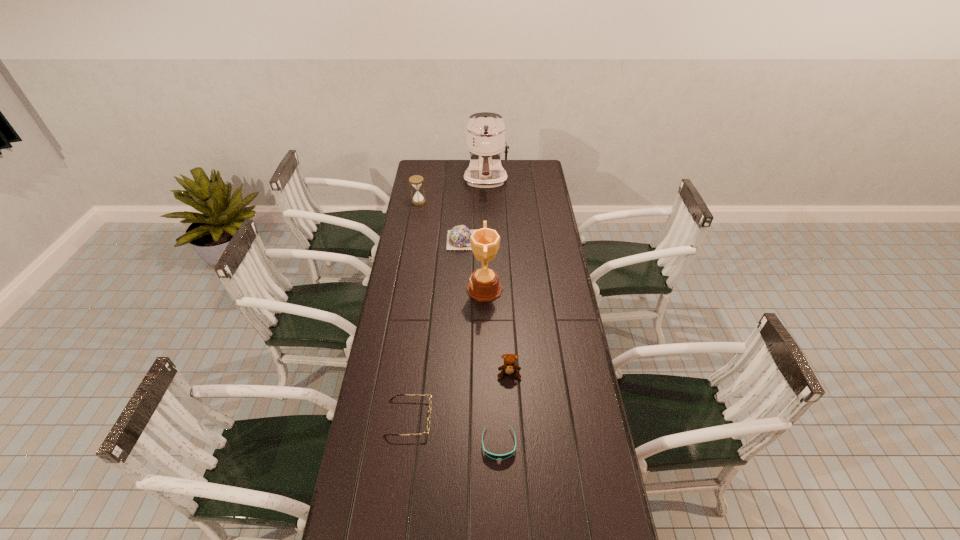
Locate an element on the screen. free space located on the front-facing side of the coffee maker is located at coordinates (487, 210).

The image size is (960, 540). Find the location of `vacant point located 0.200m on the front-facing side of the sixth shortest object`. vacant point located 0.200m on the front-facing side of the sixth shortest object is located at coordinates (421, 289).

Locate an element on the screen. This screenshot has height=540, width=960. vacant space located on the front-facing side of the sixth shortest object is located at coordinates (415, 289).

Image resolution: width=960 pixels, height=540 pixels. I want to click on blank space located 0.230m on the front-facing side of the sixth shortest object, so click(415, 289).

Locate an element on the screen. free space located on the front of the fifth shortest object is located at coordinates point(415,226).

Find the location of a particular element. free space located on the front-facing side of the third nearest object is located at coordinates (512, 424).

Where is `blank space located 0.310m on the front, side, and top of the third shortest object`? blank space located 0.310m on the front, side, and top of the third shortest object is located at coordinates (556, 240).

You are a GUI agent. You are given a task and a screenshot of the screen. Output one action in this format:
    pyautogui.click(x=<x>, y=<y>)
    Task: Click on the vacant area located on the lenses of the spectacles
    
    Given the screenshot: What is the action you would take?
    pyautogui.click(x=544, y=418)

Locate an element on the screen. The width and height of the screenshot is (960, 540). vacant space situated on the front-facing side of the shortest object is located at coordinates (501, 505).

At what (x,y) coordinates should I click in order to perform the action: click on object that is at the far edge. Please return your answer as a coordinate pair (x, y). Looking at the image, I should click on (485, 131).